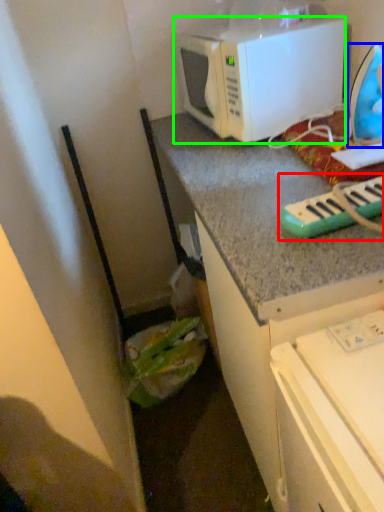
Question: Which is nearer to the musical keyboard (highlighted by a red box)? appliance (highlighted by a blue box) or microwave oven (highlighted by a green box).

Choices:
 (A) appliance
 (B) microwave oven

Answer: (A)